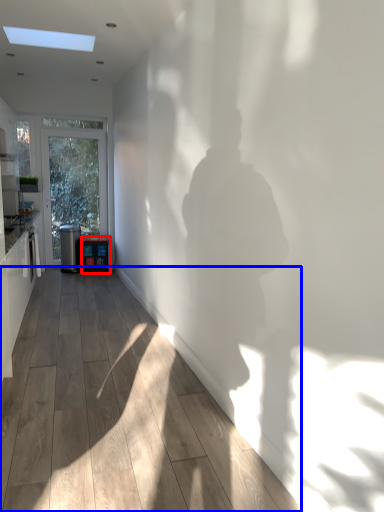
Question: Among these objects, which one is farthest to the camera, appliance (highlighted by a red box) or corridor (highlighted by a blue box)?

Choices:
 (A) appliance
 (B) corridor

Answer: (A)